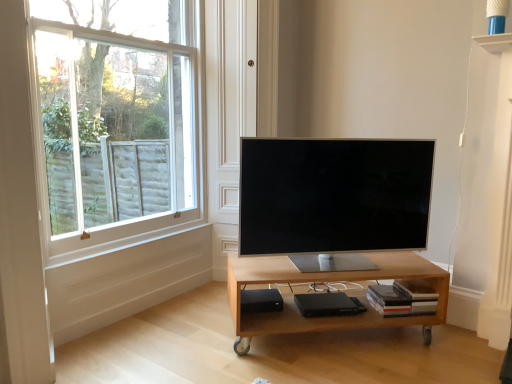
Question: Should I look upward or downward to see black matte speaker at lower center?

Choices:
 (A) down
 (B) up

Answer: (A)

Question: Is black matte speaker at lower center positioned far away from satin silver tv at center?

Choices:
 (A) no
 (B) yes

Answer: (A)

Question: Is black matte speaker at lower center in front of satin silver tv at center?

Choices:
 (A) yes
 (B) no

Answer: (B)

Question: Is black matte speaker at lower center placed right next to satin silver tv at center?

Choices:
 (A) yes
 (B) no

Answer: (B)

Question: From a real-world perspective, is black matte speaker at lower center physically below satin silver tv at center?

Choices:
 (A) yes
 (B) no

Answer: (A)

Question: Is black matte speaker at lower center thinner than satin silver tv at center?

Choices:
 (A) yes
 (B) no

Answer: (A)

Question: From the image's perspective, is black matte speaker at lower center on satin silver tv at center?

Choices:
 (A) yes
 (B) no

Answer: (B)

Question: Does light wood/matte table at center have a greater height compared to white wood window at upper left?

Choices:
 (A) yes
 (B) no

Answer: (B)

Question: From the image's perspective, is light wood/matte table at center over white wood window at upper left?

Choices:
 (A) yes
 (B) no

Answer: (B)

Question: Is light wood/matte table at center to the right of white wood window at upper left from the viewer's perspective?

Choices:
 (A) no
 (B) yes

Answer: (B)

Question: Is light wood/matte table at center not near white wood window at upper left?

Choices:
 (A) no
 (B) yes

Answer: (B)

Question: Is light wood/matte table at center directly adjacent to white wood window at upper left?

Choices:
 (A) yes
 (B) no

Answer: (B)

Question: Would you say light wood/matte table at center contains white wood window at upper left?

Choices:
 (A) yes
 (B) no

Answer: (B)

Question: From a real-world perspective, does black matte speaker at lower center stand above light wood/matte table at center?

Choices:
 (A) no
 (B) yes

Answer: (A)